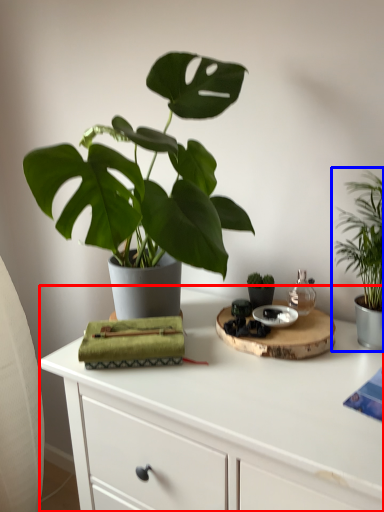
Question: Which object is further to the camera taking this photo, table (highlighted by a red box) or houseplant (highlighted by a blue box)?

Choices:
 (A) table
 (B) houseplant

Answer: (B)